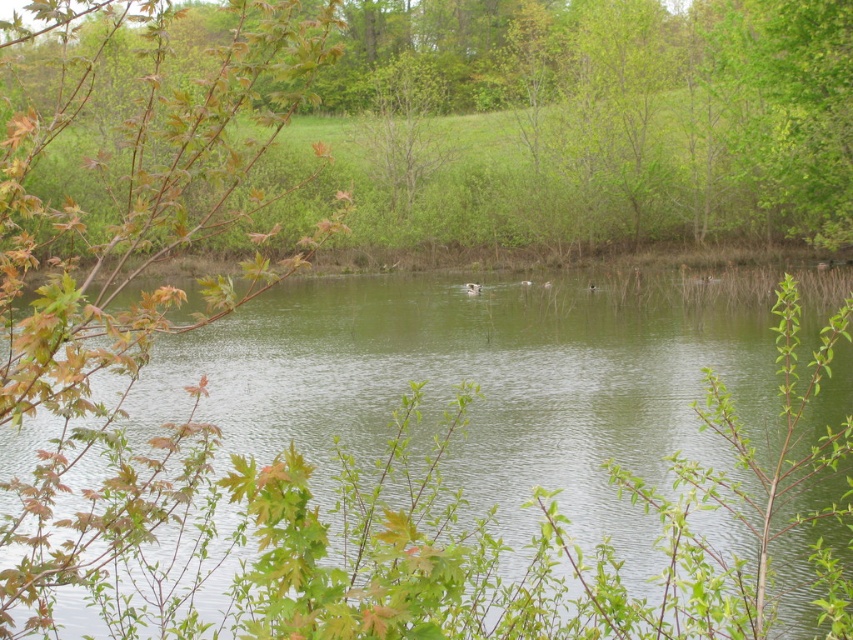
Question: Which of the following is the closest to the observer?

Choices:
 (A) (821, 209)
 (B) (212, 458)
 (C) (352, 60)

Answer: (B)

Question: Which object is positioned closest to the green leafy tree at upper right?

Choices:
 (A) white matte duck at center
 (B) green smooth water at center

Answer: (A)

Question: Which object is positioned farthest from the white matte duck at center?

Choices:
 (A) green leafy tree at upper right
 (B) green smooth water at center

Answer: (B)

Question: Can you confirm if green leafy tree at upper right is positioned to the right of white matte duck at center?

Choices:
 (A) yes
 (B) no

Answer: (A)

Question: Observing the image, what is the correct spatial positioning of green leafy branch at upper left in reference to green leafy tree at upper right?

Choices:
 (A) above
 (B) below

Answer: (A)

Question: Considering the relative positions of green smooth water at center and green leafy branch at upper left in the image provided, where is green smooth water at center located with respect to green leafy branch at upper left?

Choices:
 (A) right
 (B) left

Answer: (B)